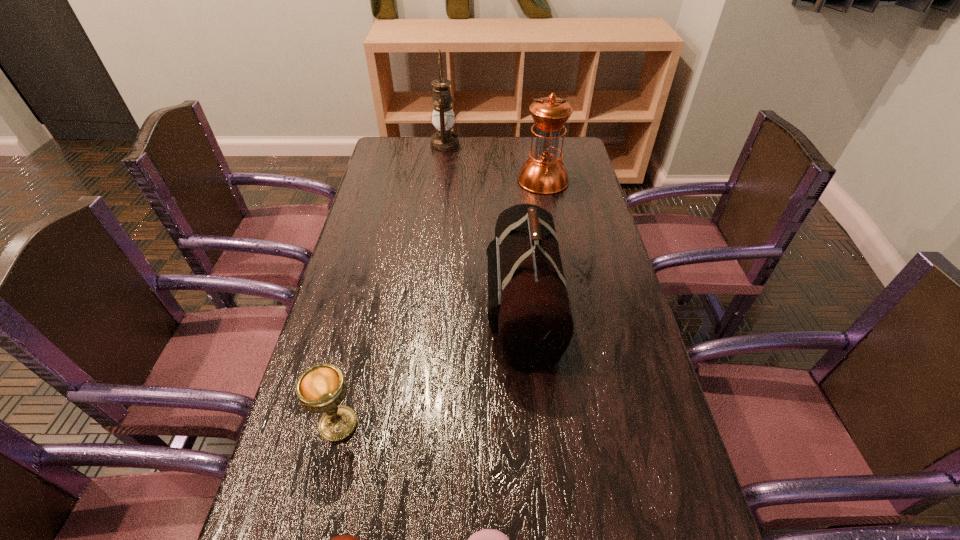
Where is `the farther oil lamp`? the farther oil lamp is located at coordinates (444, 140).

Image resolution: width=960 pixels, height=540 pixels. In order to click on the farthest object in this screenshot , I will do `click(444, 140)`.

The image size is (960, 540). What are the coordinates of `the right oil lamp` in the screenshot? It's located at (544, 173).

At what (x,y) coordinates should I click in order to perform the action: click on the nearer oil lamp. Please return your answer as a coordinate pair (x, y). Looking at the image, I should click on (544, 173).

Where is `duffel bag`? duffel bag is located at coordinates (528, 308).

Identify the location of the third nearest object. (321, 388).

Locate an element on the screen. the fourth tallest object is located at coordinates (321, 388).

You are a GUI agent. You are given a task and a screenshot of the screen. Output one action in this format:
    pyautogui.click(x=<x>, y=<y>)
    Task: Click on the free location located 0.050m on the left of the farther oil lamp
    
    Given the screenshot: What is the action you would take?
    418,146

Find the location of `free space located on the right of the nearer oil lamp`. free space located on the right of the nearer oil lamp is located at coordinates coord(588,180).

Where is `vacant area situated 0.100m on the front pocket of the duffel bag`? This screenshot has height=540, width=960. vacant area situated 0.100m on the front pocket of the duffel bag is located at coordinates (448, 307).